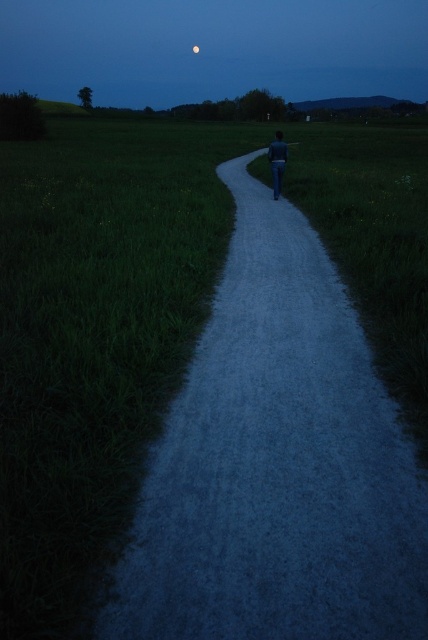
Question: Estimate the real-world distances between objects in this image. Which object is farther from the full moon at upper center?

Choices:
 (A) silvery reflective moon at upper center
 (B) blue denim jeans at center

Answer: (B)

Question: Which point is farther to the camera?

Choices:
 (A) blue denim jeans at center
 (B) silvery reflective moon at upper center
 (C) full moon at upper center

Answer: (C)

Question: Does full moon at upper center appear on the left side of blue denim jeans at center?

Choices:
 (A) yes
 (B) no

Answer: (A)

Question: Which point is farther from the camera taking this photo?

Choices:
 (A) (219, 54)
 (B) (275, 134)
 (C) (193, 49)

Answer: (A)

Question: Considering the relative positions of full moon at upper center and silvery reflective moon at upper center in the image provided, where is full moon at upper center located with respect to silvery reflective moon at upper center?

Choices:
 (A) above
 (B) below

Answer: (A)

Question: Does blue denim jeans at center have a smaller size compared to silvery reflective moon at upper center?

Choices:
 (A) yes
 (B) no

Answer: (B)